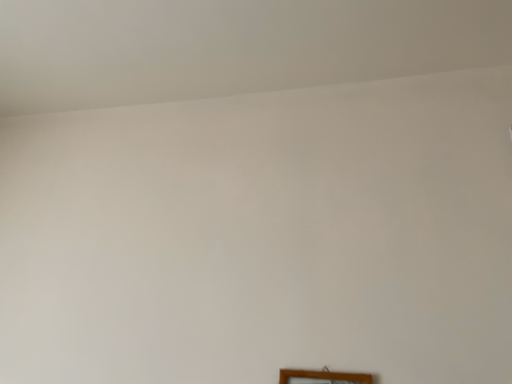
Describe the element at coordinates (322, 377) in the screenshot. I see `wooden picture frame at bottom` at that location.

I want to click on wooden picture frame at bottom, so click(322, 377).

Locate an element on the screen. Image resolution: width=512 pixels, height=384 pixels. wooden picture frame at bottom is located at coordinates (322, 377).